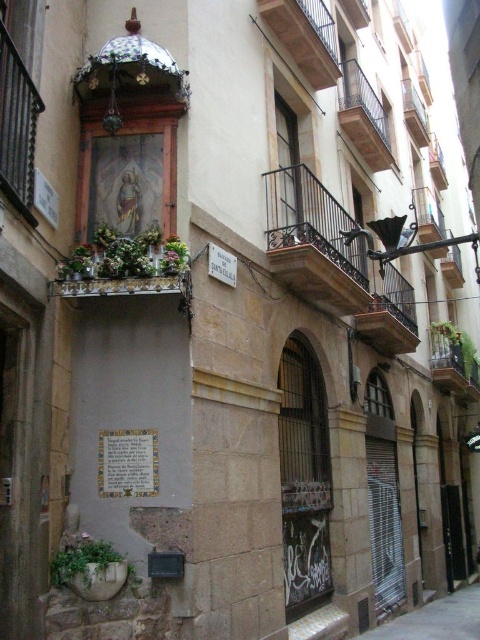
You are a delivery person trying to park your 1.2 meter wide cart on the gray concrete pavement at lower center. The rustic wood balcony at upper center is directly above your parking spot. Is there enough space for your cart to fit without touching the balcony?

The gray concrete pavement at lower center is larger in size than the rustic wood balcony at upper center, so there should be enough space for the cart to fit without touching the balcony.

You are a delivery person holding a package that needs to be placed exactly between the rustic wrought iron balcony at center and the white paper plaque at center. What is the minimum distance you need to move the package from the balcony to reach the midpoint?

The rustic wrought iron balcony at center is 11.96 feet away from the white paper plaque at center. To find the midpoint, divide the distance by 2, so the minimum distance to move the package from the balcony is 5.98 feet.

You are a tourist standing at the entrance of the street. You want to take a photo of the rustic wrought iron balcony at center. Where should you stand to capture it in the best possible angle?

The rustic wrought iron balcony at center is located at point (313, 243), so you should position yourself directly in front of it to capture it head on.